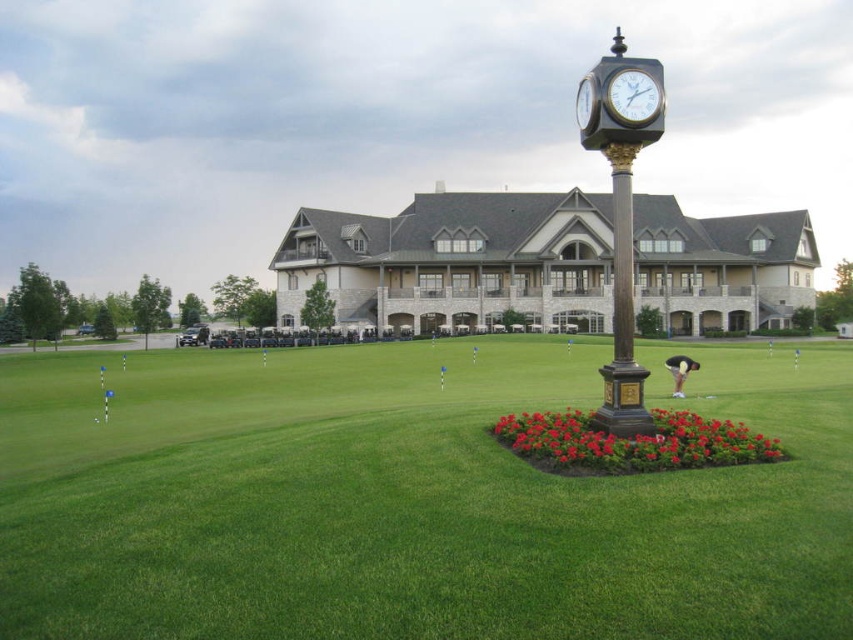
Does green grass at center have a greater height compared to polished bronze clock at center?

No.

Identify the location of green grass at center. (410, 499).

Does stone gray building at center appear over bronze/golden pole at center?

Incorrect, stone gray building at center is not positioned above bronze/golden pole at center.

Can you confirm if stone gray building at center is smaller than bronze/golden pole at center?

Actually, stone gray building at center might be larger than bronze/golden pole at center.

Who is more distant from viewer, (776, 241) or (625, 392)?

Point (776, 241)

The width and height of the screenshot is (853, 640). I want to click on stone gray building at center, so click(x=456, y=260).

Is vivid red petals at center positioned before metallic gold clock at center?

Yes, it is in front of metallic gold clock at center.

Does point (737, 452) come in front of point (579, 88)?

Yes, it is.

Is point (566, 461) less distant than point (579, 90)?

Yes, it is.

What are the coordinates of `vivid red petals at center` in the screenshot? It's located at (x=633, y=442).